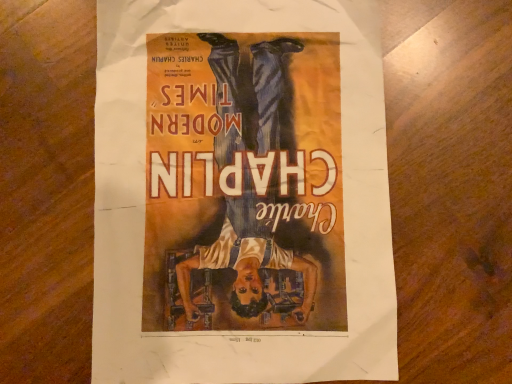
This screenshot has height=384, width=512. What do you see at coordinates (240, 195) in the screenshot?
I see `matte paper poster at center` at bounding box center [240, 195].

Where is `matte paper poster at center`? The width and height of the screenshot is (512, 384). matte paper poster at center is located at coordinates (240, 195).

This screenshot has width=512, height=384. What are the coordinates of `matte paper poster at center` in the screenshot? It's located at (240, 195).